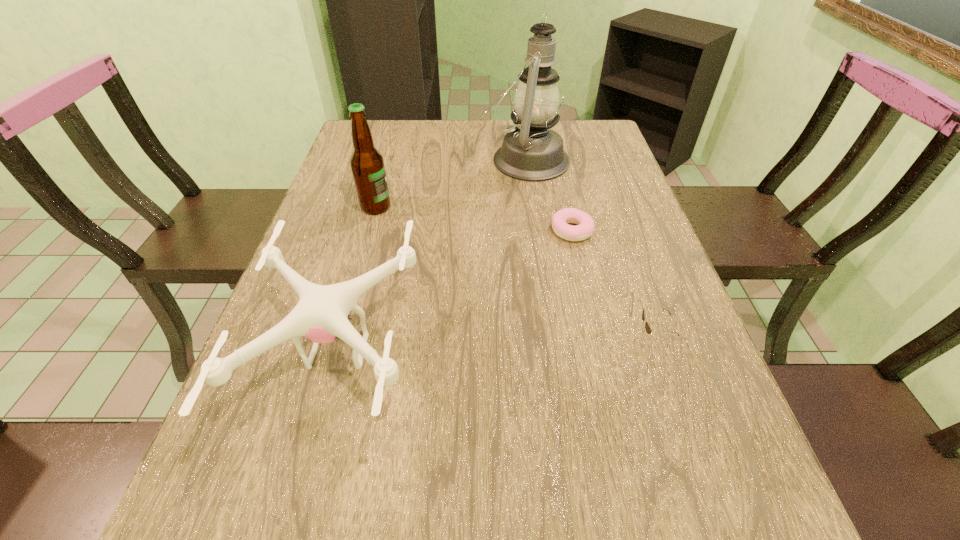
This screenshot has height=540, width=960. What are the coordinates of `vacant space in between the drone and the second shortest object` in the screenshot? It's located at (496, 344).

This screenshot has width=960, height=540. Find the location of `vacant region between the tallest object and the second farthest object`. vacant region between the tallest object and the second farthest object is located at coordinates (450, 184).

The height and width of the screenshot is (540, 960). I want to click on free space that is in between the second farthest object and the second shortest object, so click(x=515, y=272).

You are a GUI agent. You are given a task and a screenshot of the screen. Output one action in this format:
    pyautogui.click(x=<x>, y=<y>)
    Task: Click on the vacant area that lies between the third farthest object and the fourth tallest object
    
    Given the screenshot: What is the action you would take?
    pyautogui.click(x=612, y=284)

Identify the location of free space that is in between the third farthest object and the tallest object. The image size is (960, 540). (548, 195).

This screenshot has width=960, height=540. Identify the location of empty space between the beer bottle and the sunglasses. (515, 272).

Point out which object is positioned as the nearest to the rightmost object. Please provide its 2D coordinates. Your answer should be formatted as a tuple, i.e. [(x, y)], where the tuple contains the x and y coordinates of a point satisfying the conditions above.

[(585, 226)]

Where is `object that stands as the second closest to the pastry`? The height and width of the screenshot is (540, 960). object that stands as the second closest to the pastry is located at coordinates (648, 329).

Locate an element on the screen. This screenshot has height=540, width=960. vacant region that satisfies the following two spatial constraints: 1. on the label of the shortest object; 2. on the right side of the second farthest object is located at coordinates (370, 231).

You are a GUI agent. You are given a task and a screenshot of the screen. Output one action in this format:
    pyautogui.click(x=<x>, y=<y>)
    Task: Click on the vacant point that satisfies the following two spatial constraints: 1. on the label of the shortest object; 2. on the left side of the second tallest object
    
    Given the screenshot: What is the action you would take?
    pyautogui.click(x=370, y=231)